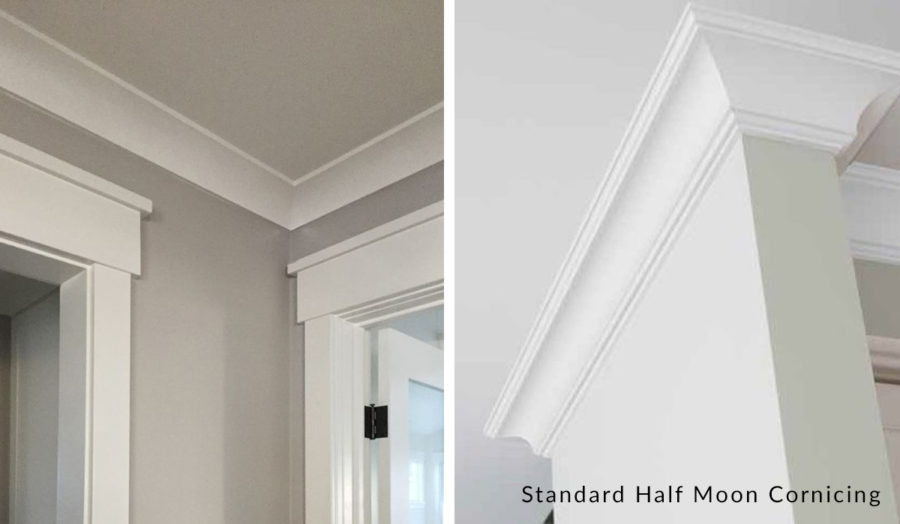
Locate an element on the screen. This screenshot has height=524, width=900. cornicing (text) is located at coordinates (824, 495).